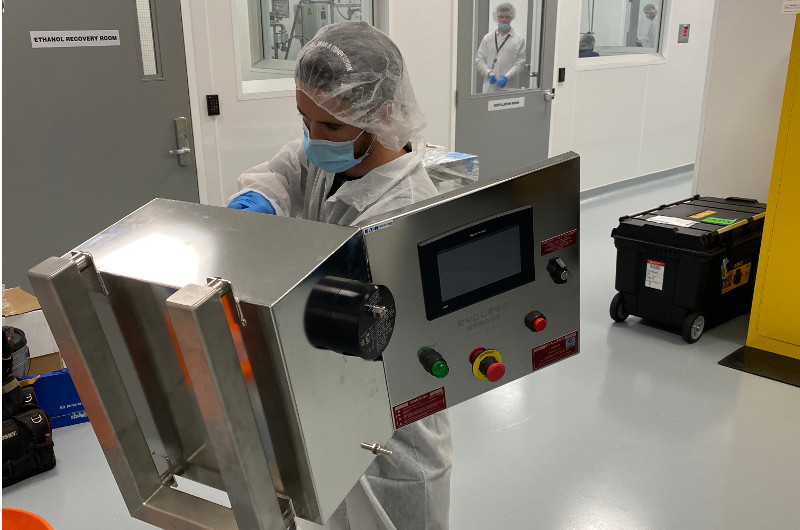
Find the location of `windows`. windows is located at coordinates (612, 31), (264, 54).